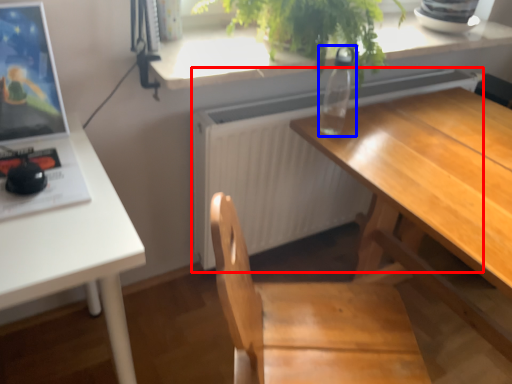
Question: Among these objects, which one is farthest to the camera, radiator (highlighted by a red box) or bottle (highlighted by a blue box)?

Choices:
 (A) radiator
 (B) bottle

Answer: (A)